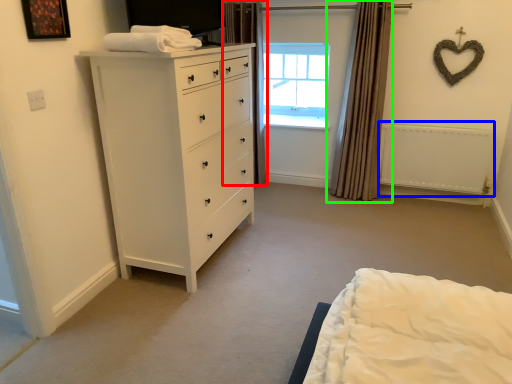
Question: Which object is the farthest from curtain (highlighted by a red box)? Choose among these: radiator (highlighted by a blue box) or curtain (highlighted by a green box).

Choices:
 (A) radiator
 (B) curtain

Answer: (A)